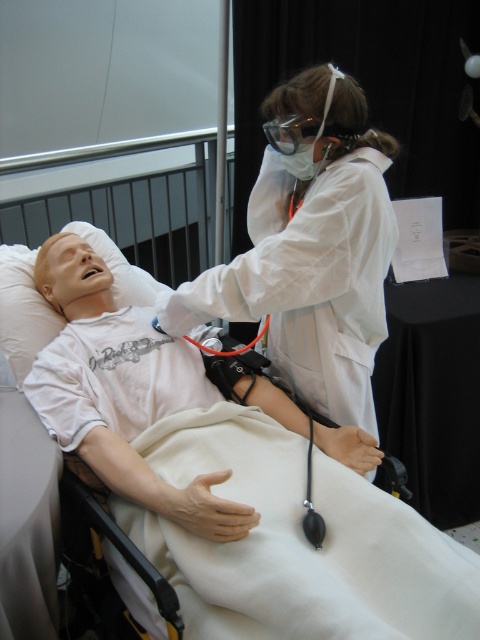
Consider the image. You are a medical student preparing to examine the white matte mannequin at center and the transparent plastic goggles at upper center. Which object should you approach first to ensure proper examination technique?

You should approach the white matte mannequin at center first because it is closer to you than the transparent plastic goggles at upper center, so it is more accessible for examination.

Consider the image. Based on the scene, where is the white matte mannequin at center located in terms of coordinates?

The white matte mannequin at center is located at point [120,388].